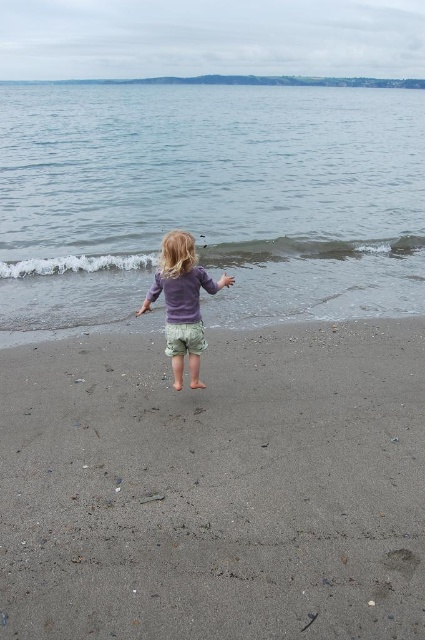
Question: Which object is the closest to the sandy at center?

Choices:
 (A) purple cotton shirt at center
 (B) blue water at center

Answer: (A)

Question: Which point is farther to the camera?

Choices:
 (A) purple cotton shirt at center
 (B) blue water at center

Answer: (B)

Question: Estimate the real-world distances between objects in this image. Which object is farther from the sandy at center?

Choices:
 (A) blue water at center
 (B) purple cotton shirt at center

Answer: (A)

Question: From the image, what is the correct spatial relationship of blue water at center in relation to purple cotton shirt at center?

Choices:
 (A) left
 (B) right

Answer: (A)

Question: Where is blue water at center located in relation to purple cotton shirt at center in the image?

Choices:
 (A) right
 (B) left

Answer: (B)

Question: Can you confirm if blue water at center is wider than purple cotton shirt at center?

Choices:
 (A) yes
 (B) no

Answer: (A)